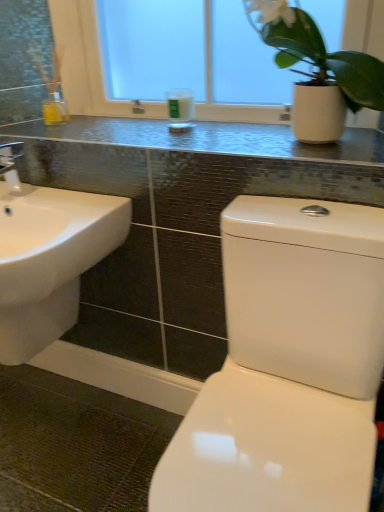
Question: Does white glass candle at center have a smaller size compared to metallic mosaic tile counter top at upper center?

Choices:
 (A) no
 (B) yes

Answer: (B)

Question: Is white glass candle at center far away from metallic mosaic tile counter top at upper center?

Choices:
 (A) no
 (B) yes

Answer: (A)

Question: From the image's perspective, is white glass candle at center beneath metallic mosaic tile counter top at upper center?

Choices:
 (A) no
 (B) yes

Answer: (A)

Question: Can you confirm if white glass candle at center is positioned to the right of metallic mosaic tile counter top at upper center?

Choices:
 (A) yes
 (B) no

Answer: (A)

Question: Does white glass candle at center have a larger size compared to metallic mosaic tile counter top at upper center?

Choices:
 (A) yes
 (B) no

Answer: (B)

Question: Is white glass candle at center closer to the viewer compared to metallic mosaic tile counter top at upper center?

Choices:
 (A) yes
 (B) no

Answer: (B)

Question: From a real-world perspective, is white glass candle at center over white glossy toilet at lower right?

Choices:
 (A) yes
 (B) no

Answer: (A)

Question: From the image's perspective, is white glass candle at center located beneath white glossy toilet at lower right?

Choices:
 (A) no
 (B) yes

Answer: (A)

Question: Considering the relative sizes of white glass candle at center and white glossy toilet at lower right in the image provided, is white glass candle at center thinner than white glossy toilet at lower right?

Choices:
 (A) yes
 (B) no

Answer: (A)

Question: From the image's perspective, is white glass candle at center located above white glossy toilet at lower right?

Choices:
 (A) no
 (B) yes

Answer: (B)

Question: Does white glass candle at center come behind white glossy toilet at lower right?

Choices:
 (A) no
 (B) yes

Answer: (B)

Question: Is white glass candle at center at the left side of white glossy toilet at lower right?

Choices:
 (A) yes
 (B) no

Answer: (A)

Question: Is white glossy sink at lower left not near metallic mosaic tile counter top at upper center?

Choices:
 (A) no
 (B) yes

Answer: (A)